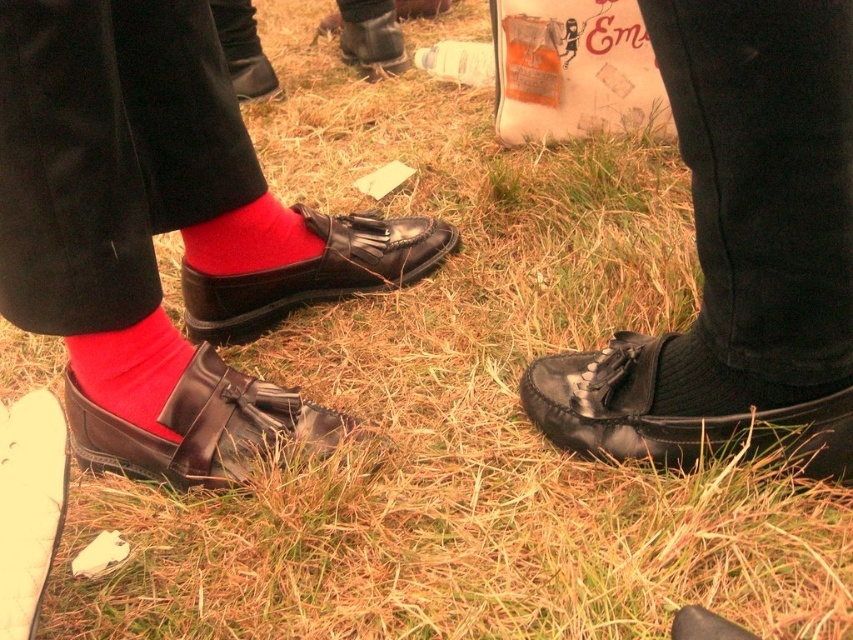
Question: Can you confirm if shiny black loafer at lower center is wider than matte leather shoe at left?

Choices:
 (A) no
 (B) yes

Answer: (A)

Question: Which of the following is the closest to the observer?

Choices:
 (A) (207, 344)
 (B) (24, 3)
 (C) (613, 381)
 (D) (393, 278)

Answer: (B)

Question: Can you confirm if matte leather shoe at left is positioned to the right of matte black loafer at left?

Choices:
 (A) yes
 (B) no

Answer: (B)

Question: Can you confirm if matte black loafer at left is positioned below red cotton sock at left?

Choices:
 (A) no
 (B) yes

Answer: (A)

Question: Considering the real-world distances, which object is farthest from the black leather shoe at lower right?

Choices:
 (A) matte black loafer at left
 (B) matte red sock at left

Answer: (B)

Question: Which point is closer to the camera?

Choices:
 (A) matte leather shoe at left
 (B) shiny black loafer at lower center
 (C) black leather shoe at lower right
 (D) matte red sock at left

Answer: (B)